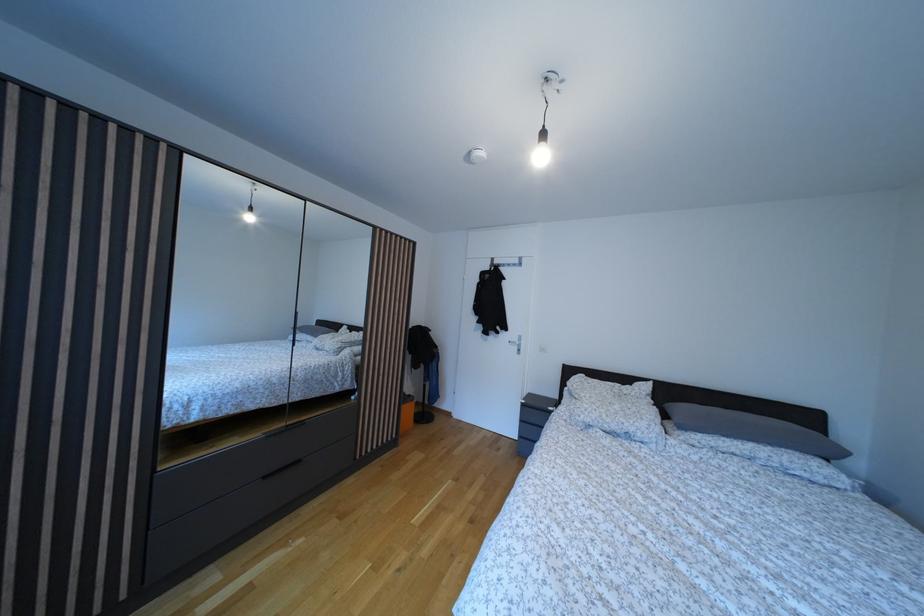
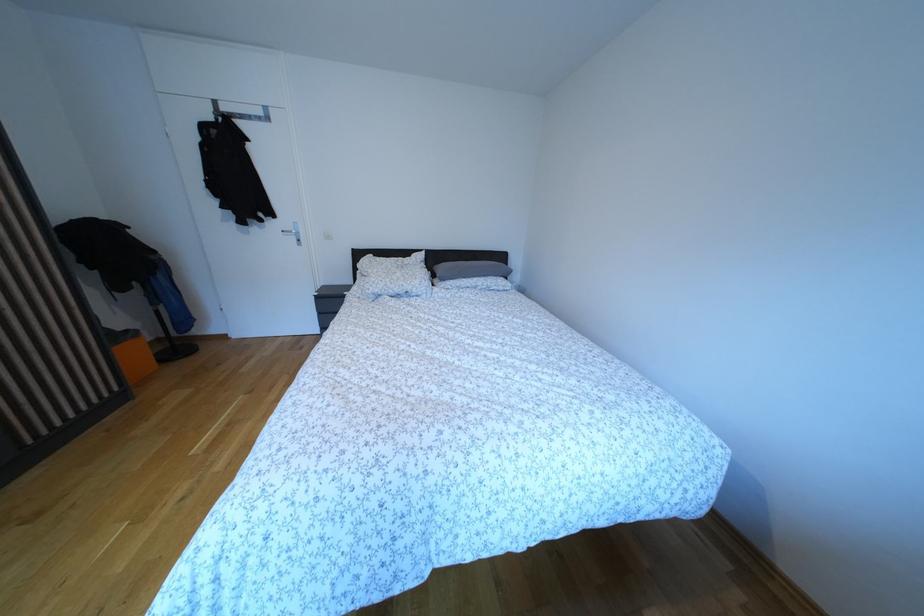
The point at (623, 413) is marked in the first image. Where is the corresponding point in the second image?

(406, 281)